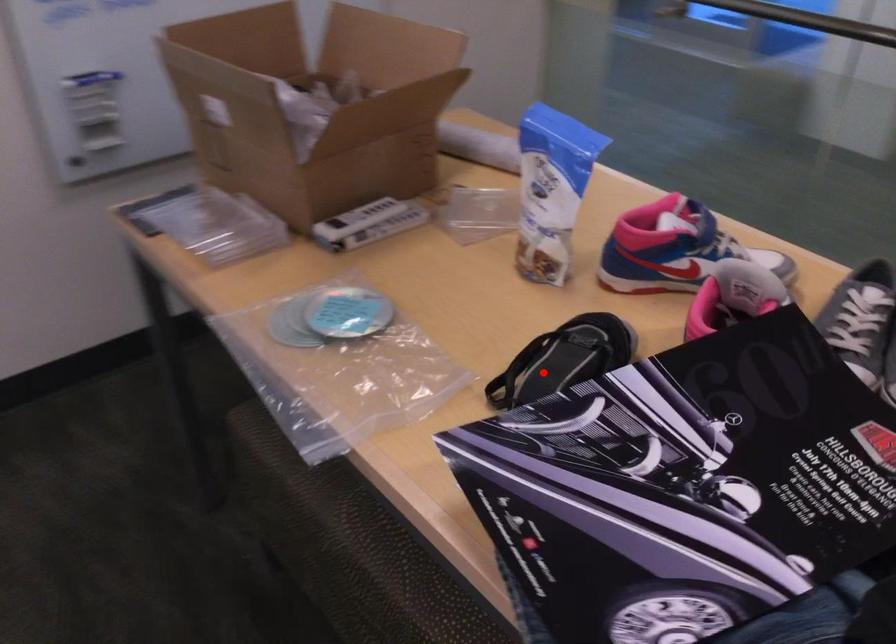
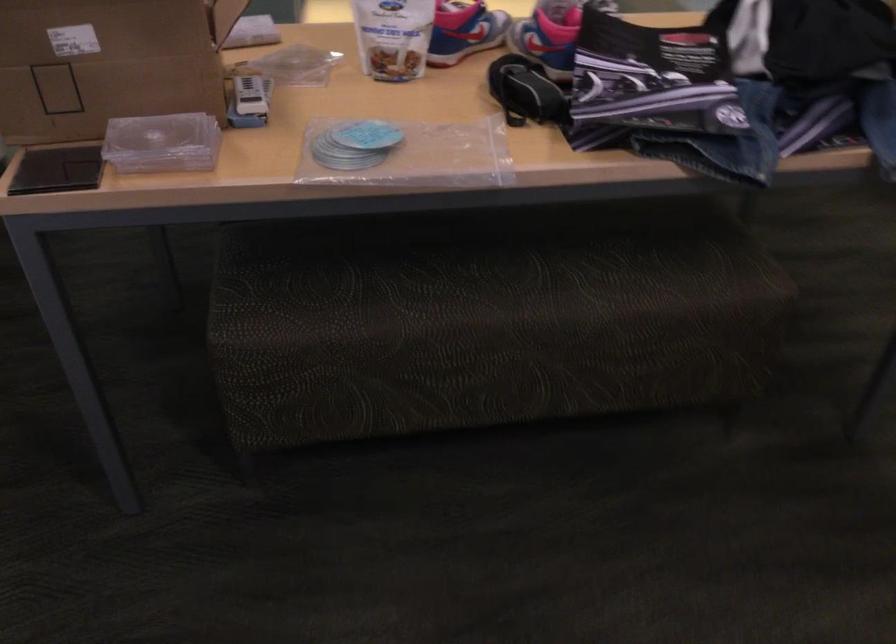
Question: A red point is marked in image1. In image2, is the corresponding 3D point closer to the camera or farther? Reply with the corresponding letter.

Choices:
 (A) The corresponding 3D point is closer.
 (B) The corresponding 3D point is farther.

Answer: (B)